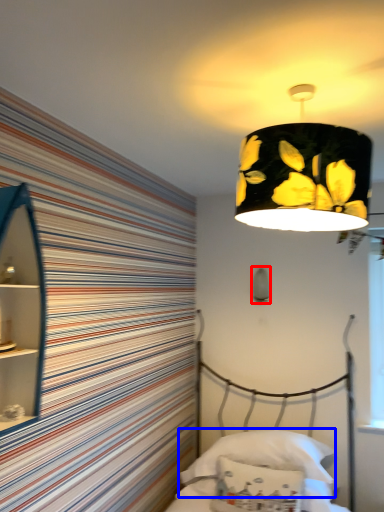
Question: Which point is closer to the camera, lamp (highlighted by a red box) or pillow (highlighted by a blue box)?

Choices:
 (A) lamp
 (B) pillow

Answer: (B)